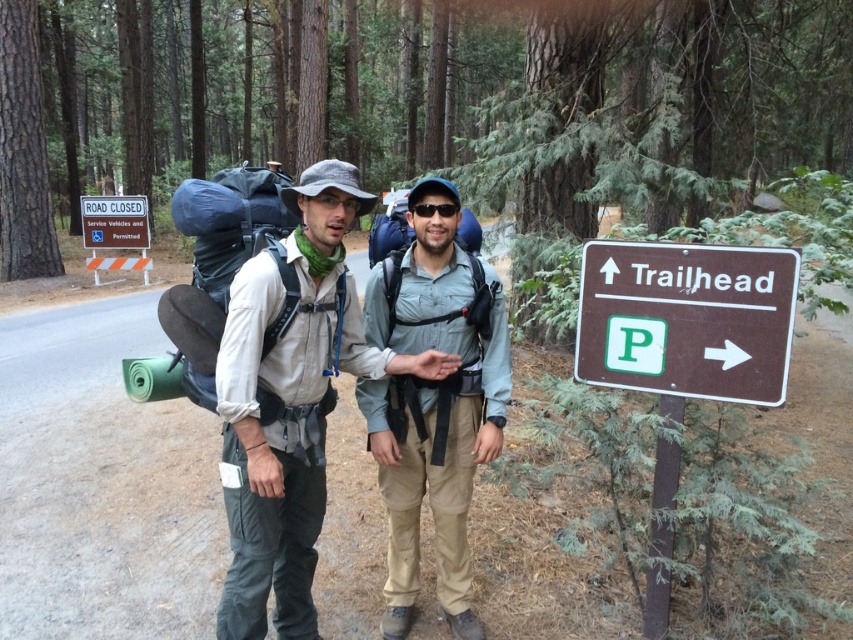
Can you confirm if matte khaki pants at center is wider than matte blue backpack at center?

Correct, the width of matte khaki pants at center exceeds that of matte blue backpack at center.

Which of these two, matte khaki pants at center or matte blue backpack at center, stands shorter?

matte blue backpack at center is shorter.

This screenshot has width=853, height=640. What are the coordinates of `matte khaki pants at center` in the screenshot? It's located at (291, 403).

Which is behind, point (453, 576) or point (96, 220)?

Positioned behind is point (96, 220).

You are a GUI agent. You are given a task and a screenshot of the screen. Output one action in this format:
    pyautogui.click(x=<x>, y=<y>)
    Task: Click on the matte blue backpack at center
    The height and width of the screenshot is (640, 853).
    Given the screenshot: What is the action you would take?
    pyautogui.click(x=433, y=404)

In order to click on matte blue backpack at center in this screenshot , I will do `click(433, 404)`.

Which is more to the right, green textured pine trees at upper left or brown wooden sign at right?

From the viewer's perspective, brown wooden sign at right appears more on the right side.

Is point (726, 81) positioned after point (677, 353)?

Yes, it is behind point (677, 353).

Identify the location of green textured pine trees at upper left. (425, 104).